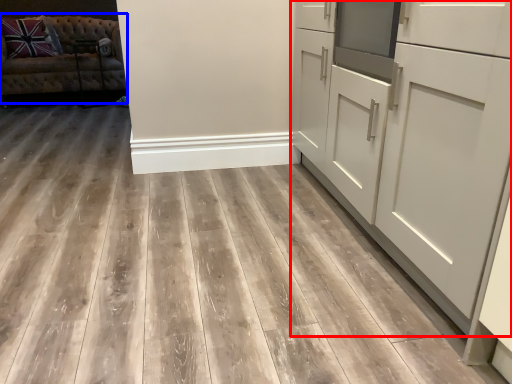
Question: Which object appears closest to the camera in this image, cabinetry (highlighted by a red box) or studio couch (highlighted by a blue box)?

Choices:
 (A) cabinetry
 (B) studio couch

Answer: (A)